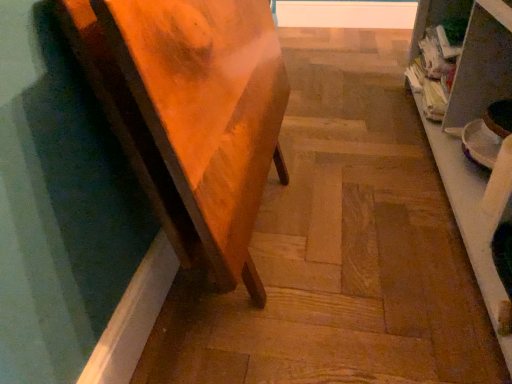
Question: Considering the positions of white glossy shelf at right and wooden step at center in the image, is white glossy shelf at right bigger or smaller than wooden step at center?

Choices:
 (A) big
 (B) small

Answer: (A)

Question: Considering the positions of point (415, 51) and point (168, 345), is point (415, 51) closer or farther from the camera than point (168, 345)?

Choices:
 (A) farther
 (B) closer

Answer: (A)

Question: Based on their relative distances, which object is nearer to the wooden table at left?

Choices:
 (A) white glossy shelf at right
 (B) wooden step at center

Answer: (B)

Question: Estimate the real-world distances between objects in this image. Which object is closer to the wooden table at left?

Choices:
 (A) white glossy shelf at right
 (B) wooden step at center

Answer: (B)